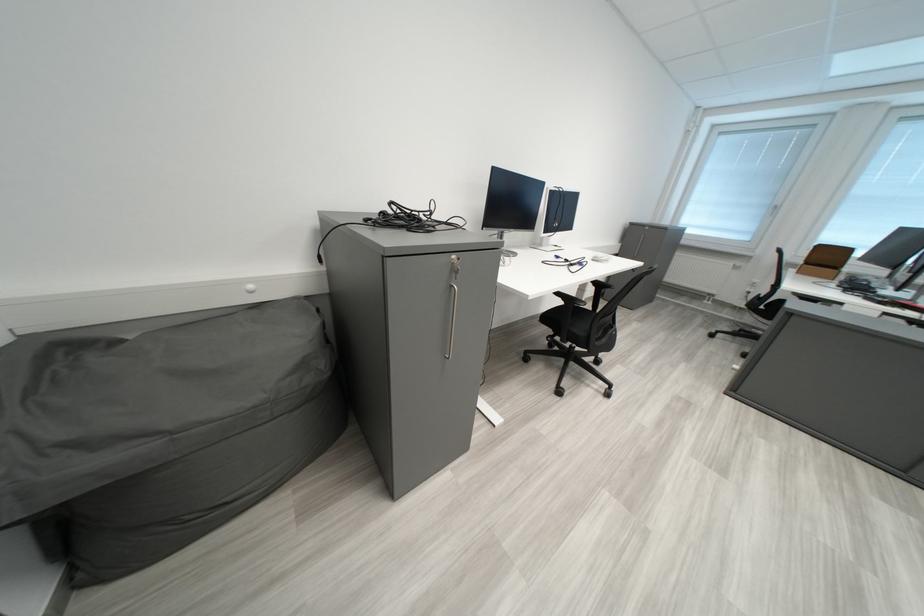
The location [824,261] corresponds to which object?

This point indicates the cardboard box.